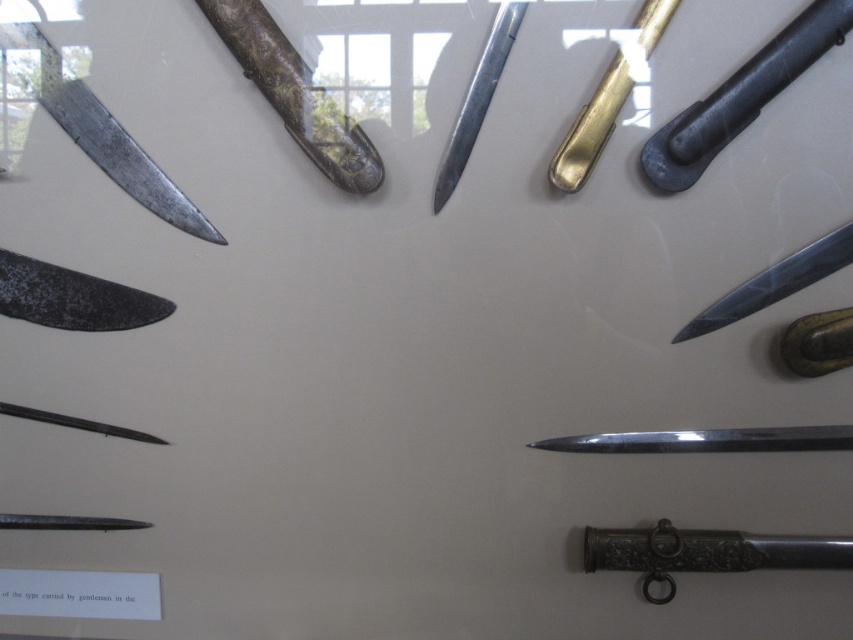
You are a collector who wants to place a new decorative item between the black matte sword at upper right and the shiny silver knife at right. What is the minimum space required to fit the item between them?

The black matte sword at upper right and the shiny silver knife at right are 9.40 inches apart from each other, so the minimum space required to fit an item between them is less than 9.40 inches.

You are a photographer adjusting the focus on your camera. You want to capture both the point at point (173, 218) and the point at point (488, 100) in sharp focus. Which point should you focus on first to ensure both are in focus?

You should focus on point (173, 218) first because it is closer to the camera than point (488, 100), allowing the depth of field to cover both points effectively.

You are an appraiser examining the knives and daggers displayed in a circular pattern. You need to determine which object is nearer to you between the shiny silver blade at upper left and the polished silver dagger at lower center. Which one is closer?

The shiny silver blade at upper left is closer to the viewer than the polished silver dagger at lower center.